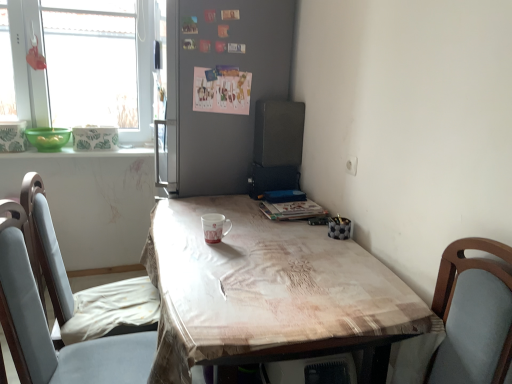
Describe the element at coordinates (48, 138) in the screenshot. I see `green matte bowl at left` at that location.

Locate an element on the screen. black matte speaker at upper right is located at coordinates (278, 133).

Describe the element at coordinates (278, 133) in the screenshot. I see `black matte speaker at upper right` at that location.

The height and width of the screenshot is (384, 512). I want to click on green glossy bowls at left, so click(x=81, y=153).

Where is `transparent glass window at upper left`? transparent glass window at upper left is located at coordinates (86, 64).

Where is `coffee cup that appears above the light blue fabric chair at lower left (from a real-world perspective)`? The width and height of the screenshot is (512, 384). coffee cup that appears above the light blue fabric chair at lower left (from a real-world perspective) is located at coordinates (214, 227).

From a real-world perspective, between white glossy mug at center and light blue fabric chair at lower left, who is vertically lower?

In real-world perspective, light blue fabric chair at lower left is lower.

Is white glossy mug at center positioned beyond the bounds of light blue fabric chair at lower left?

Indeed, white glossy mug at center is completely outside light blue fabric chair at lower left.

Can you confirm if light blue fabric chair at lower left is thinner than black matte speaker at upper right?

No, light blue fabric chair at lower left is not thinner than black matte speaker at upper right.

Which is correct: light blue fabric chair at lower left is inside black matte speaker at upper right, or outside of it?

light blue fabric chair at lower left is located beyond the bounds of black matte speaker at upper right.

Is light blue fabric chair at lower left not close to black matte speaker at upper right?

light blue fabric chair at lower left is far away from black matte speaker at upper right.

From a real-world perspective, between light blue fabric chair at lower left and black matte speaker at upper right, who is vertically lower?

From a 3D spatial view, light blue fabric chair at lower left is below.

From a real-world perspective, which is physically above, green matte bowl at left or transparent glass window at upper left?

transparent glass window at upper left is physically above.

Is there a large distance between green matte bowl at left and transparent glass window at upper left?

That's not correct — green matte bowl at left is a little close to transparent glass window at upper left.

From the image's perspective, relative to transparent glass window at upper left, is green matte bowl at left above or below?

Based on their image positions, green matte bowl at left is located beneath transparent glass window at upper left.

Can you confirm if green matte bowl at left is taller than transparent glass window at upper left?

Incorrect, the height of green matte bowl at left is not larger of that of transparent glass window at upper left.

Does green matte bowl at left turn towards matte gray bulletin board at center?

No, green matte bowl at left is not facing towards matte gray bulletin board at center.

Identify the location of glass bowl that appears on the left of matte gray bulletin board at center. (48, 138).

From a real-world perspective, is green matte bowl at left above or below matte gray bulletin board at center?

Clearly, from a real-world perspective, green matte bowl at left is below matte gray bulletin board at center.

Can you confirm if transparent glass window at upper left is smaller than black matte speaker at upper right?

No.

From a real-world perspective, which object stands above the other?

From a 3D spatial view, transparent glass window at upper left is above.

In order to click on loudspeaker that appears on the right of transparent glass window at upper left in this screenshot , I will do `click(278, 133)`.

Can you confirm if black matte speaker at upper right is positioned to the left of green glossy bowls at left?

Incorrect, black matte speaker at upper right is not on the left side of green glossy bowls at left.

From a real-world perspective, which is physically below, black matte speaker at upper right or green glossy bowls at left?

green glossy bowls at left.

Looking at this image, is black matte speaker at upper right not inside green glossy bowls at left?

black matte speaker at upper right lies outside green glossy bowls at left's area.

Looking at their sizes, would you say black matte speaker at upper right is wider or thinner than green glossy bowls at left?

Considering their sizes, black matte speaker at upper right looks slimmer than green glossy bowls at left.

Is point (46, 55) positioned in front of point (39, 146)?

Yes.

Is transparent glass window at upper left at the left side of green matte bowl at left?

No.

At what (x,y) coordinates should I click in order to perform the action: click on window that is in front of the green matte bowl at left. Please return your answer as a coordinate pair (x, y). This screenshot has height=384, width=512. Looking at the image, I should click on (86, 64).

The image size is (512, 384). Find the location of `chair lying on the left of white glossy mug at center`. chair lying on the left of white glossy mug at center is located at coordinates (49, 333).

Identify the location of loudspeaker on the right of light blue fabric chair at lower left. The width and height of the screenshot is (512, 384). (278, 133).

Looking at the image, which one is located closer to green glossy bowls at left, light brown fabric table at center or transparent glass window at upper left?

Based on the image, transparent glass window at upper left appears to be nearer to green glossy bowls at left.

Looking at the image, which one is located further to green matte bowl at left, light blue fabric chair at lower left or white glossy mug at center?

light blue fabric chair at lower left.

Based on their spatial positions, is transparent glass window at upper left or black matte speaker at upper right further from green glossy bowls at left?

black matte speaker at upper right.

Consider the image. Estimate the real-world distances between objects in this image. Which object is closer to transparent glass window at upper left, green glossy bowls at left or light blue fabric chair at lower left?

green glossy bowls at left.

Which object lies further to the anchor point green matte bowl at left, light blue fabric chair at lower left or black matte speaker at upper right?

light blue fabric chair at lower left.

Looking at the image, which one is located further to green matte bowl at left, light brown fabric table at center or green glossy bowls at left?

light brown fabric table at center is positioned further to the anchor green matte bowl at left.

From the image, which object appears to be farther from transparent glass window at upper left, light brown fabric table at center or matte gray bulletin board at center?

light brown fabric table at center lies further to transparent glass window at upper left than the other object.

Considering their positions, is green matte bowl at left positioned closer to light brown fabric table at center than transparent glass window at upper left?

transparent glass window at upper left is positioned closer to the anchor light brown fabric table at center.

This screenshot has width=512, height=384. Find the location of `coffee cup positioned between light blue fabric chair at lower left and green matte bowl at left from near to far`. coffee cup positioned between light blue fabric chair at lower left and green matte bowl at left from near to far is located at coordinates (214, 227).

You are a GUI agent. You are given a task and a screenshot of the screen. Output one action in this format:
    pyautogui.click(x=<x>, y=<y>)
    Task: Click on the coffee cup located between light brown fabric table at center and transparent glass window at upper left in the depth direction
    The width and height of the screenshot is (512, 384).
    Given the screenshot: What is the action you would take?
    pyautogui.click(x=214, y=227)

Locate an element on the screen. The height and width of the screenshot is (384, 512). chair positioned between light brown fabric table at center and white glossy mug at center from near to far is located at coordinates (49, 333).

Locate an element on the screen. Image resolution: width=512 pixels, height=384 pixels. chair positioned between light brown fabric table at center and matte gray bulletin board at center from near to far is located at coordinates (49, 333).